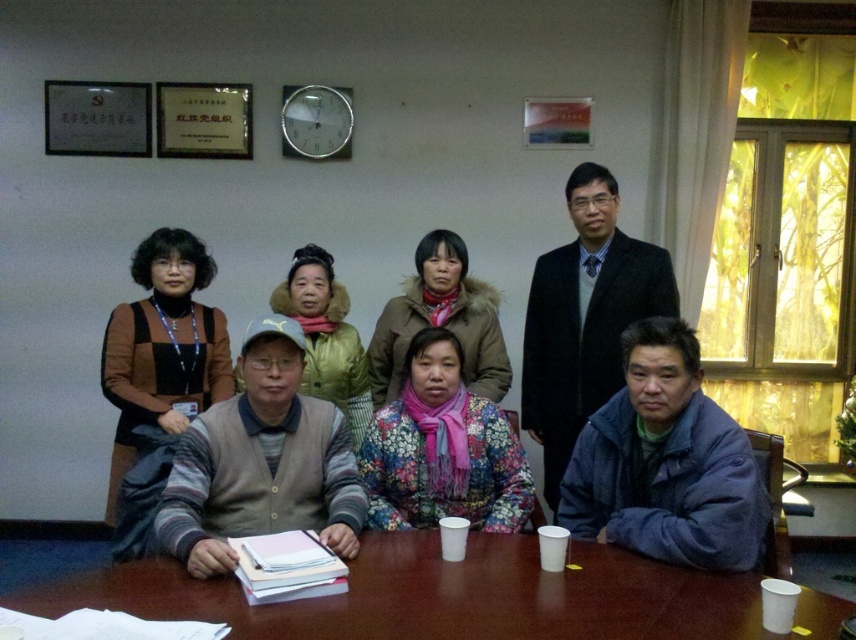
Is floral fabric scarf at center closer to the viewer compared to matte yellow jacket at center?

Yes.

Between floral fabric scarf at center and matte yellow jacket at center, which one has more height?

With more height is matte yellow jacket at center.

The image size is (856, 640). I want to click on floral fabric scarf at center, so click(443, 449).

Which of these two, brown wooden table at center or matte yellow jacket at center, stands shorter?

With less height is brown wooden table at center.

Does brown wooden table at center appear over matte yellow jacket at center?

Incorrect, brown wooden table at center is not positioned above matte yellow jacket at center.

Between point (730, 577) and point (313, 273), which one is positioned in front?

Point (730, 577) is in front.

Identify the location of brown wooden table at center. (456, 596).

Is brown knitted sweater at upper left shorter than matte yellow jacket at center?

Incorrect, brown knitted sweater at upper left's height does not fall short of matte yellow jacket at center's.

Does point (146, 419) lie behind point (300, 259)?

That is False.

I want to click on brown knitted sweater at upper left, so click(x=162, y=348).